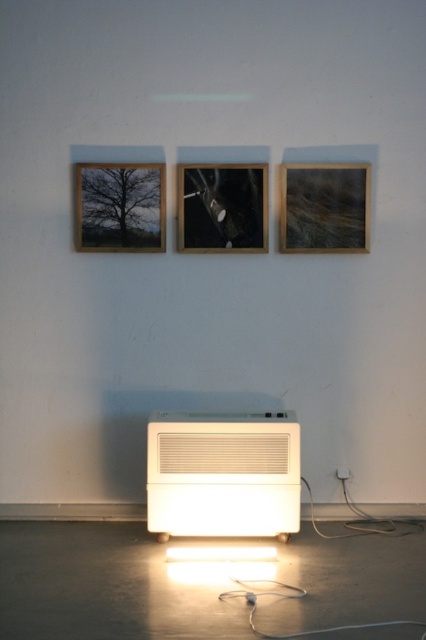
Is white plastic air conditioner at lower center closer to camera compared to wooden frame at upper left?

That is True.

Consider the image. Between white plastic air conditioner at lower center and wooden frame at upper left, which one is positioned higher?

wooden frame at upper left is above.

Is point (157, 497) positioned before point (106, 195)?

Yes, point (157, 497) is closer to viewer.

Find the location of a particular element. The height and width of the screenshot is (640, 426). white plastic air conditioner at lower center is located at coordinates (222, 474).

Is white plastic air conditioner at lower center thinner than matte black frame at center?

No.

Who is taller, white plastic air conditioner at lower center or matte black frame at center?

With more height is white plastic air conditioner at lower center.

Which is behind, point (256, 531) or point (221, 236)?

Point (221, 236)

Find the location of a particular element. Image resolution: width=426 pixels, height=640 pixels. white plastic air conditioner at lower center is located at coordinates (222, 474).

Does white plastic air conditioner at lower center appear on the right side of wooden frame at center?

In fact, white plastic air conditioner at lower center is to the left of wooden frame at center.

Can you confirm if white plastic air conditioner at lower center is positioned to the left of wooden frame at center?

Indeed, white plastic air conditioner at lower center is positioned on the left side of wooden frame at center.

Who is more distant from viewer, (264, 477) or (310, 196)?

Positioned behind is point (310, 196).

Locate an element on the screen. white plastic air conditioner at lower center is located at coordinates (222, 474).